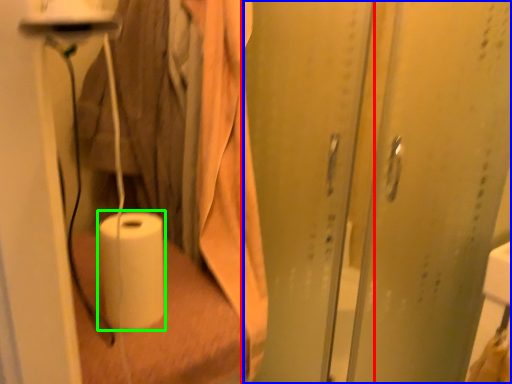
Question: Considering the real-world distances, which object is farthest from screen door (highlighted by a red box)? screen door (highlighted by a blue box) or paper towel (highlighted by a green box)?

Choices:
 (A) screen door
 (B) paper towel

Answer: (B)